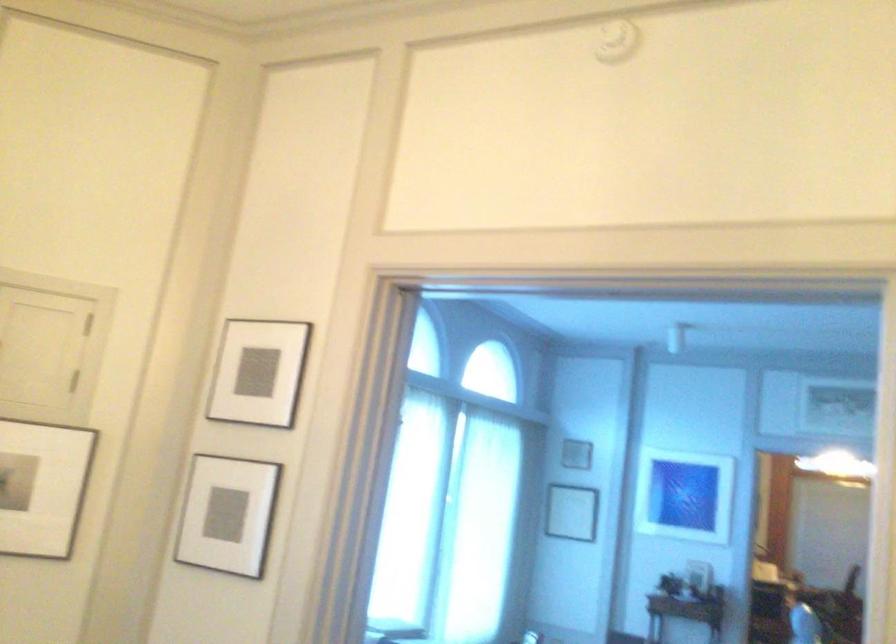
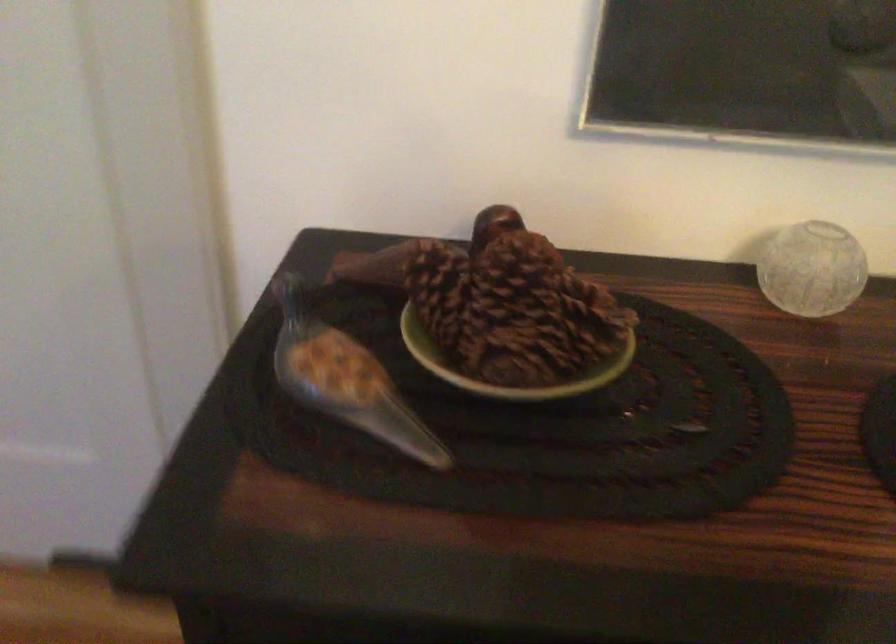
The first image is from the beginning of the video and the second image is from the end. How did the camera likely rotate when shooting the video?

The camera's rotation is toward right-down.